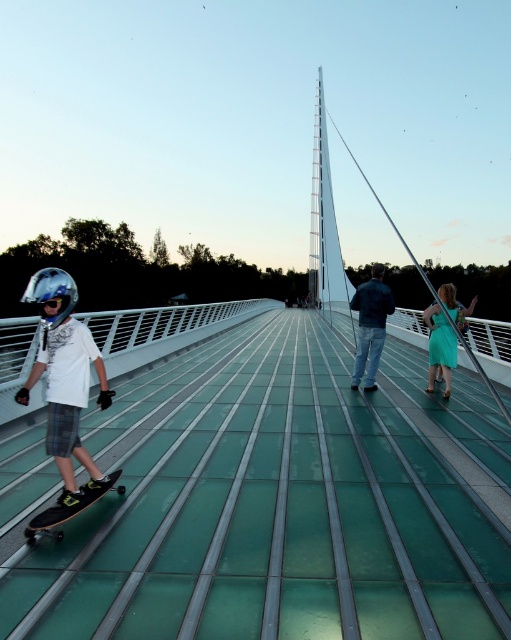
You are trying to determine if the transparent glass bridge at center can support the weight of the silver metallic helmet at left. Based on their sizes, which object is taller?

The silver metallic helmet at left is taller than the transparent glass bridge at center.

You are planning to walk across the transparent glass bridge at center while carrying a silver metallic helmet at left. Based on the bridge width, will the helmet fit comfortably on the bridge without touching the edges?

The transparent glass bridge at center has a lesser width compared to silver metallic helmet at left, so the helmet may not fit comfortably on the bridge without touching the edges.

You are standing on the modern pedestrian bridge and want to walk from the skateboarding area to the two adults. The skateboarding area is near point A at coordinates point (262, 548), and the two adults are near point B at coordinates point (362, 314). Which direction should you walk to reach the adults?

Since point (262, 548) is in front of point (362, 314), you should walk backward or toward the direction away from your current facing to reach the adults.